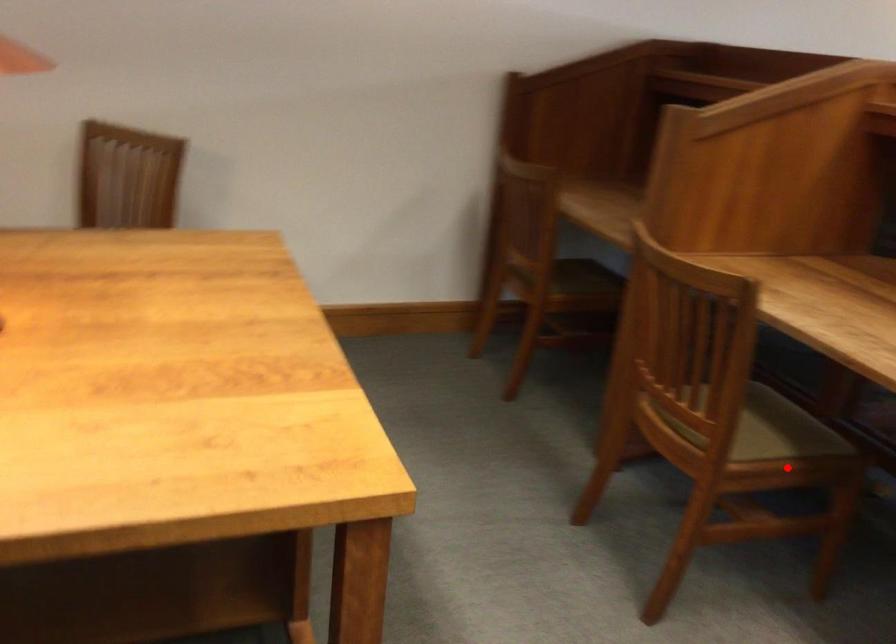
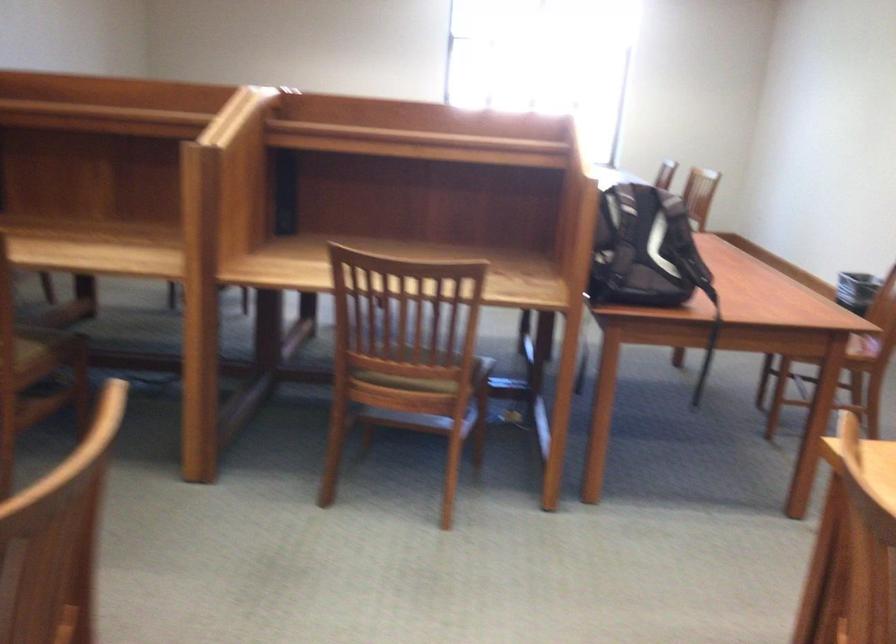
Question: I am providing you with two images of the same scene from different viewpoints. In image1, a red point is highlighted. Considering the same 3D point in image2, which of the following is correct?

Choices:
 (A) It is closer
 (B) It is farther

Answer: (B)